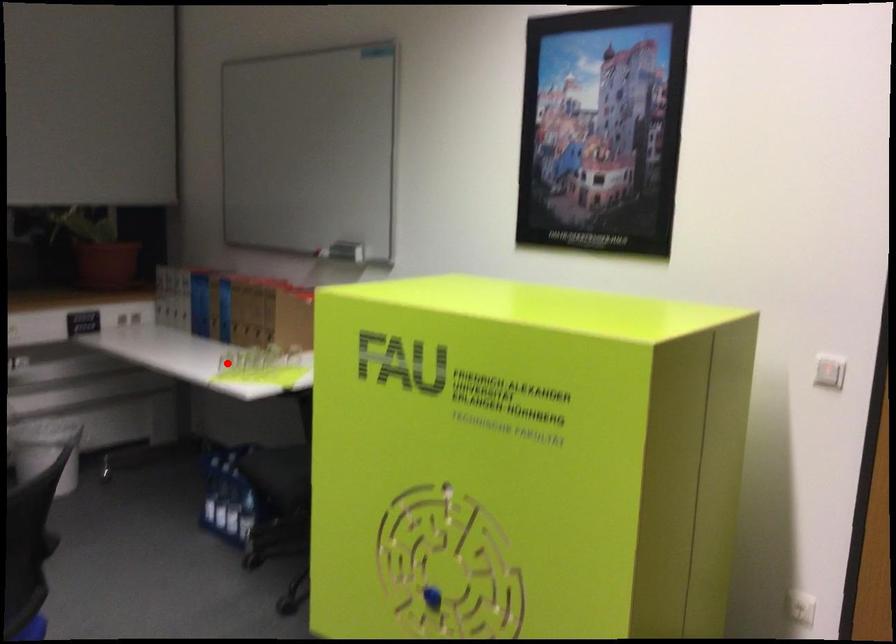
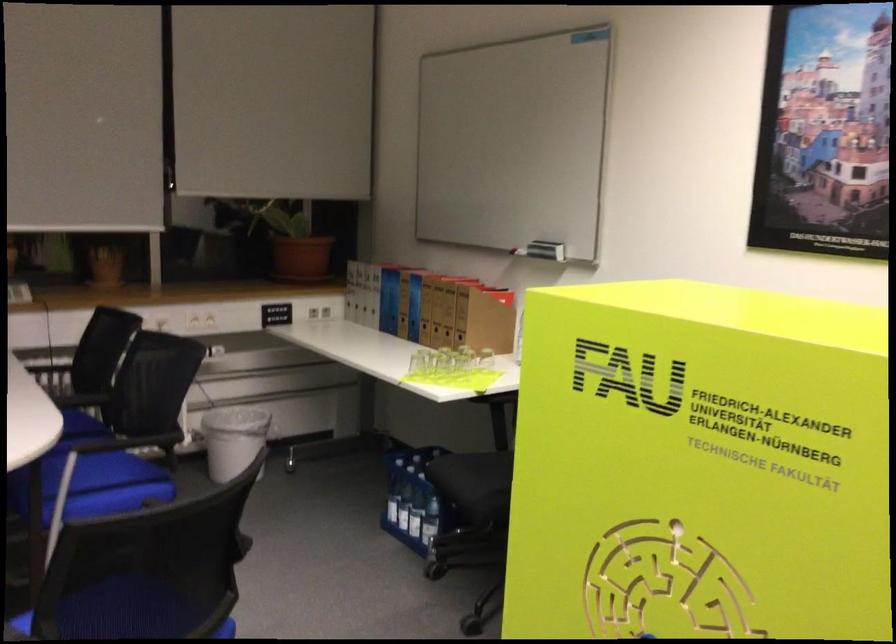
Question: I am providing you with two images of the same scene from different viewpoints. Image1 has a red point marked. In image2, the corresponding 3D location appears at what relative position? Reply with the corresponding letter.

Choices:
 (A) Closer
 (B) Farther

Answer: (A)